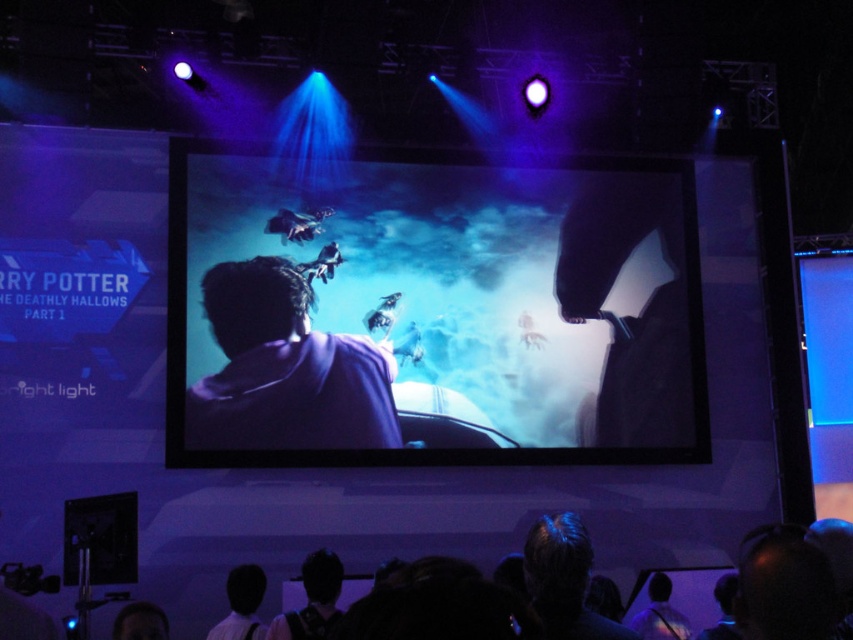
Question: Which object appears farthest from the camera in this image?

Choices:
 (A) matte black screen at center
 (B) purple fabric at center

Answer: (B)

Question: Which point is closer to the camera?

Choices:
 (A) matte black screen at center
 (B) purple fabric at center

Answer: (A)

Question: Which point is farther to the camera?

Choices:
 (A) purple fabric at center
 (B) matte black screen at center

Answer: (A)

Question: Can you confirm if matte black screen at center is bigger than purple fabric at center?

Choices:
 (A) yes
 (B) no

Answer: (A)

Question: Can you confirm if matte black screen at center is positioned below purple fabric at center?

Choices:
 (A) yes
 (B) no

Answer: (B)

Question: Is matte black screen at center to the right of purple fabric at center from the viewer's perspective?

Choices:
 (A) yes
 (B) no

Answer: (A)